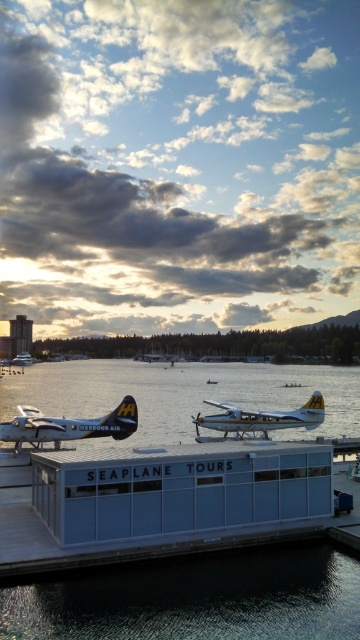
You are a photographer planning to capture the SEAPLANE TOURS building and the two silver vessels in the foreground. Since you want to emphasize the size difference between the shiny silver seaplane at lower left and the metallic silver boat at lower left, which one should you position closer to the camera to make it appear larger in the photo?

To emphasize the size difference, position the shiny silver seaplane at lower left closer to the camera since it is already bigger than the metallic silver boat at lower left. This will make the seaplane appear even larger compared to the boat in the photograph.

You are a photographer planning to take a photo of the metallic silver seaplane at center. To ensure the clear water at center is visible in the background, where should you position the seaplane in your camera frame?

Position the metallic silver seaplane at center to the right side of your camera frame so that the clear water at center to the left of it becomes the background.

You are a pilot preparing to board a seaplane for a tour. You see the shiny silver seaplane at lower left. Can you determine its exact location in the image using coordinates?

The shiny silver seaplane at lower left is located at coordinates point (183, 394).